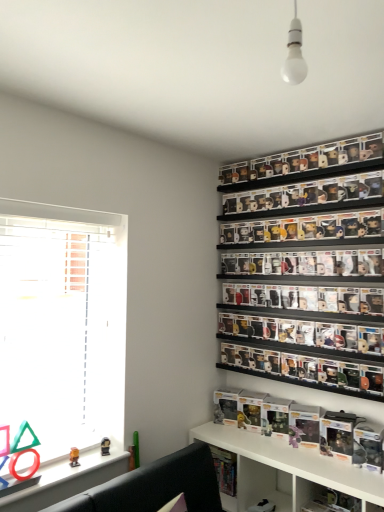
Question: Does clear plastic figures at upper right, placed as the first shelf when sorted from top to bottom, have a greater width compared to white glossy shelf at lower center, marked as the 4th shelf in a top-to-bottom arrangement?

Choices:
 (A) yes
 (B) no

Answer: (B)

Question: Are clear plastic figures at upper right, which is counted as the 4th shelf, starting from the bottom, and white glossy shelf at lower center, the first shelf positioned from the bottom, making contact?

Choices:
 (A) no
 (B) yes

Answer: (A)

Question: Is clear plastic figures at upper right, placed as the first shelf when sorted from top to bottom, to the left of white glossy shelf at lower center, the first shelf positioned from the bottom, from the viewer's perspective?

Choices:
 (A) yes
 (B) no

Answer: (B)

Question: Can you confirm if clear plastic figures at upper right, placed as the first shelf when sorted from top to bottom, is bigger than white glossy shelf at lower center, marked as the 4th shelf in a top-to-bottom arrangement?

Choices:
 (A) no
 (B) yes

Answer: (A)

Question: Does clear plastic figures at upper right, placed as the first shelf when sorted from top to bottom, have a lesser width compared to white glossy shelf at lower center, the first shelf positioned from the bottom?

Choices:
 (A) yes
 (B) no

Answer: (A)

Question: Based on their sizes in the image, would you say matte orange toy at lower left is bigger or smaller than white matte window at left?

Choices:
 (A) big
 (B) small

Answer: (B)

Question: Based on their positions, is matte orange toy at lower left located to the left or right of white matte window at left?

Choices:
 (A) left
 (B) right

Answer: (B)

Question: In terms of width, does matte orange toy at lower left look wider or thinner when compared to white matte window at left?

Choices:
 (A) thin
 (B) wide

Answer: (A)

Question: Is matte orange toy at lower left situated inside white matte window at left or outside?

Choices:
 (A) inside
 (B) outside

Answer: (A)

Question: From the image's perspective, is white glossy shelf at lower center, the first shelf positioned from the bottom, above or below matte orange toy at lower left?

Choices:
 (A) below
 (B) above

Answer: (A)

Question: Is white glossy shelf at lower center, marked as the 4th shelf in a top-to-bottom arrangement, to the left or to the right of matte orange toy at lower left in the image?

Choices:
 (A) right
 (B) left

Answer: (A)

Question: In terms of width, does white glossy shelf at lower center, marked as the 4th shelf in a top-to-bottom arrangement, look wider or thinner when compared to matte orange toy at lower left?

Choices:
 (A) wide
 (B) thin

Answer: (A)

Question: Is point (238, 446) positioned closer to the camera than point (72, 451)?

Choices:
 (A) farther
 (B) closer

Answer: (A)

Question: Considering their positions, is white glossy bulb at upper center located in front of or behind matte orange toy at lower left?

Choices:
 (A) front
 (B) behind

Answer: (A)

Question: From the image's perspective, relative to matte orange toy at lower left, is white glossy bulb at upper center above or below?

Choices:
 (A) above
 (B) below

Answer: (A)